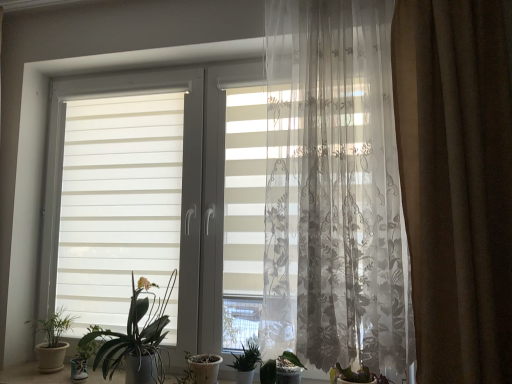
Question: Is green matte leafy plant at lower center, the 1th houseplant from the right, positioned in front of green leafy plant at center, acting as the second houseplant starting from the right?

Choices:
 (A) no
 (B) yes

Answer: (B)

Question: Are green matte leafy plant at lower center, marked as the fourth houseplant in a left-to-right arrangement, and green leafy plant at center, acting as the second houseplant starting from the right, beside each other?

Choices:
 (A) no
 (B) yes

Answer: (A)

Question: From a real-world perspective, does green matte leafy plant at lower center, the 1th houseplant from the right, stand above green leafy plant at center, acting as the second houseplant starting from the right?

Choices:
 (A) no
 (B) yes

Answer: (A)

Question: From the image's perspective, is green matte leafy plant at lower center, the 1th houseplant from the right, under green leafy plant at center, which is the 3th houseplant in left-to-right order?

Choices:
 (A) no
 (B) yes

Answer: (B)

Question: Could you tell me if green matte leafy plant at lower center, marked as the fourth houseplant in a left-to-right arrangement, is facing green leafy plant at center, which is the 3th houseplant in left-to-right order?

Choices:
 (A) no
 (B) yes

Answer: (A)

Question: Considering the relative sizes of green matte leafy plant at lower center, the 1th houseplant from the right, and green leafy plant at center, acting as the second houseplant starting from the right, in the image provided, is green matte leafy plant at lower center, the 1th houseplant from the right, taller than green leafy plant at center, acting as the second houseplant starting from the right,?

Choices:
 (A) yes
 (B) no

Answer: (B)

Question: Is white striped window at center outside green matte plant at lower left, the 1th houseplant in the left-to-right sequence?

Choices:
 (A) no
 (B) yes

Answer: (B)

Question: Are white striped window at center and green matte plant at lower left, placed as the 4th houseplant when sorted from right to left, far apart?

Choices:
 (A) no
 (B) yes

Answer: (A)

Question: Is green matte plant at lower left, the 1th houseplant in the left-to-right sequence, at the back of white striped window at center?

Choices:
 (A) no
 (B) yes

Answer: (B)

Question: From a real-world perspective, is white striped window at center under green matte plant at lower left, the 1th houseplant in the left-to-right sequence?

Choices:
 (A) no
 (B) yes

Answer: (A)

Question: From the image's perspective, is white striped window at center above green matte plant at lower left, placed as the 4th houseplant when sorted from right to left?

Choices:
 (A) no
 (B) yes

Answer: (B)

Question: Is green matte plant at lower left, placed as the 4th houseplant when sorted from right to left, inside white striped window at center?

Choices:
 (A) no
 (B) yes

Answer: (B)

Question: Is green matte leafy plant at lower center, the 1th houseplant from the right, outside white striped window at center?

Choices:
 (A) yes
 (B) no

Answer: (A)